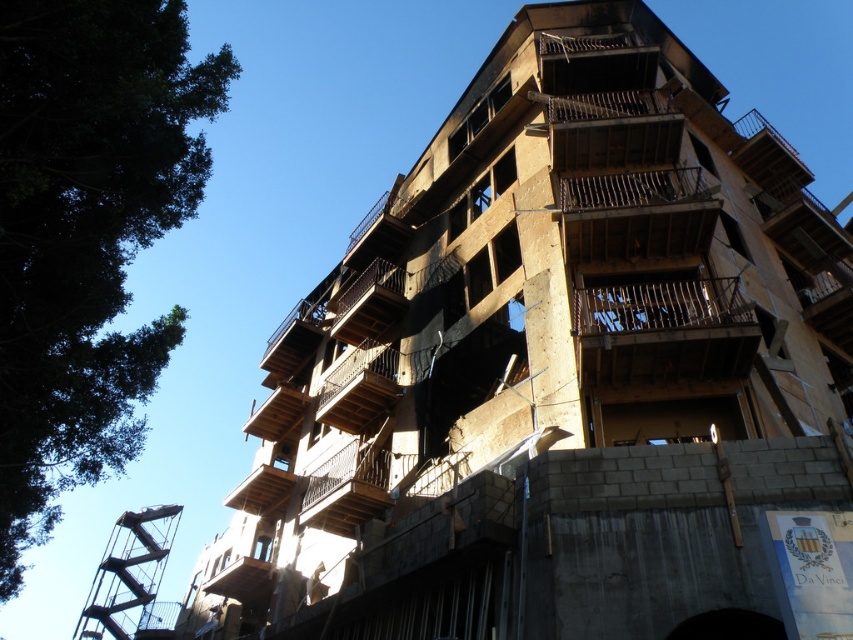
At what (x,y) coordinates should I click in order to perform the action: click on green leafy tree at upper left. Please return your answer as a coordinate pair (x, y). The height and width of the screenshot is (640, 853). Looking at the image, I should click on (86, 236).

Between green leafy tree at upper left and rusty metal balcony at center, which one has less height?

Standing shorter between the two is rusty metal balcony at center.

Is point (13, 220) farther from viewer compared to point (596, 342)?

No, it is in front of (596, 342).

Where is `green leafy tree at upper left`? The width and height of the screenshot is (853, 640). green leafy tree at upper left is located at coordinates (86, 236).

Between rusty metal balcony at center and brown wooden balcony at center, which one appears on the right side from the viewer's perspective?

Positioned to the right is rusty metal balcony at center.

Which is behind, point (740, 296) or point (369, 352)?

The point (369, 352) is more distant.

Find the location of a particular element. rusty metal balcony at center is located at coordinates (663, 332).

What do you see at coordinates (663, 332) in the screenshot? The width and height of the screenshot is (853, 640). I see `rusty metal balcony at center` at bounding box center [663, 332].

Does rusty metal balcony at center have a greater height compared to rustic wood balcony at center?

Incorrect, rusty metal balcony at center's height is not larger of rustic wood balcony at center's.

Who is more forward, (587, 337) or (374, 474)?

Point (587, 337)

Where is `rusty metal balcony at center`? This screenshot has height=640, width=853. rusty metal balcony at center is located at coordinates (663, 332).